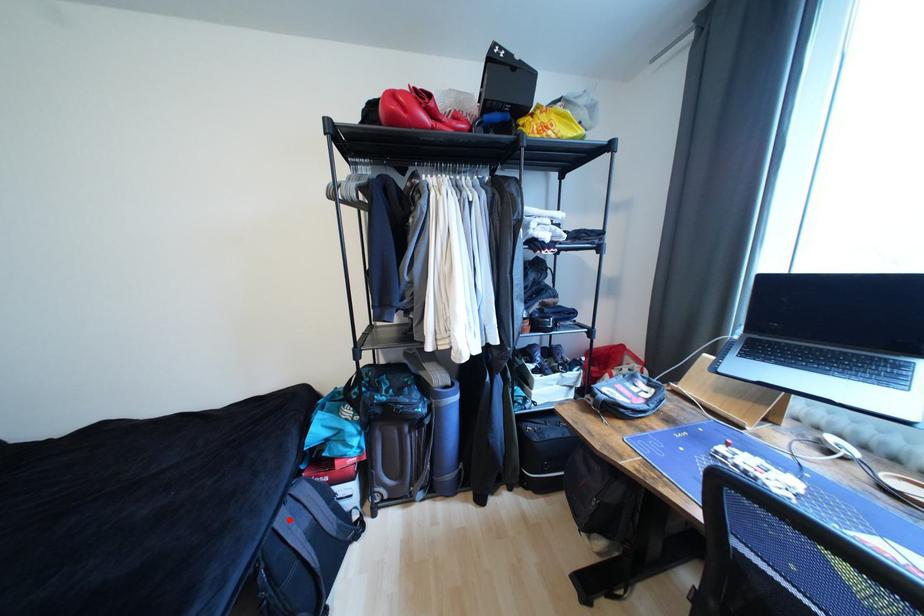
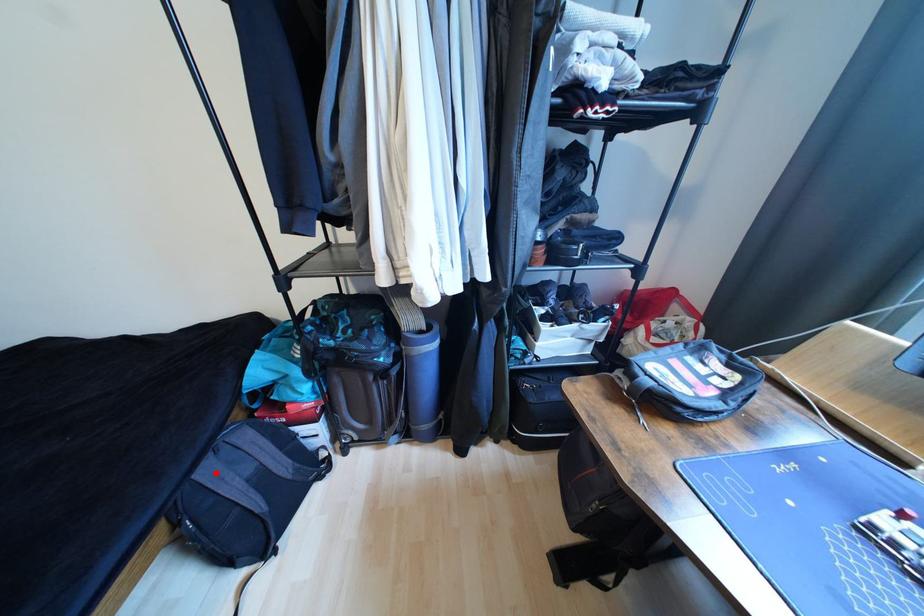
I am providing you with two images of the same scene from different viewpoints. A red point is marked on the first image and another point is marked on the second image. Does the point marked in image1 correspond to the same location as the one in image2?

Yes